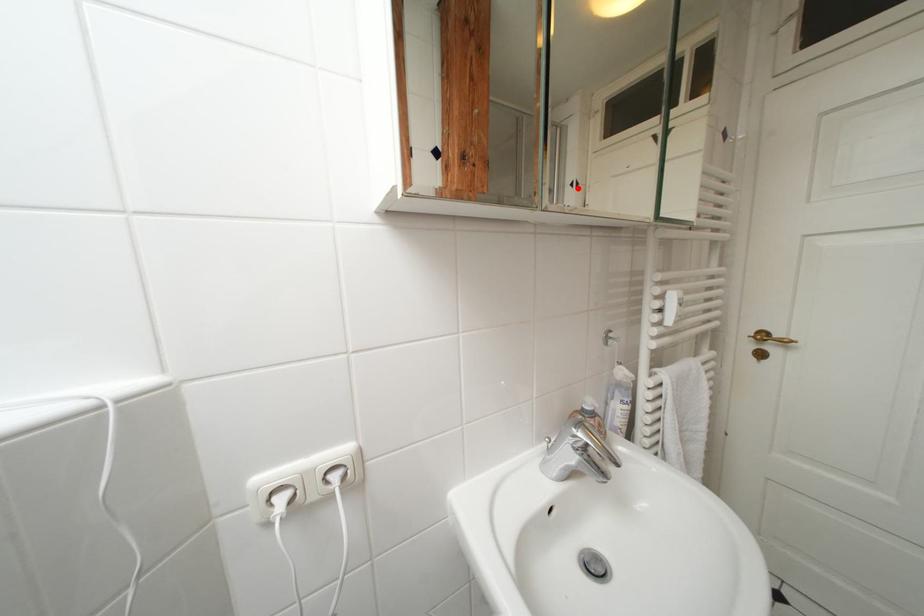
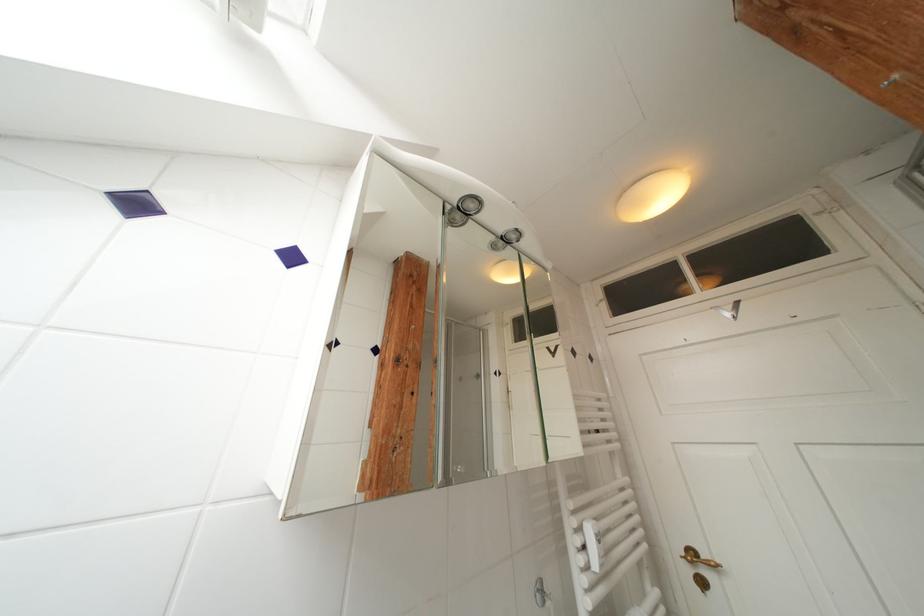
Question: I am providing you with two images of the same scene from different viewpoints. Image1 has a red point marked. In image2, the corresponding 3D location appears at what relative position? Reply with the corresponding letter.

Choices:
 (A) Closer
 (B) Farther

Answer: (B)